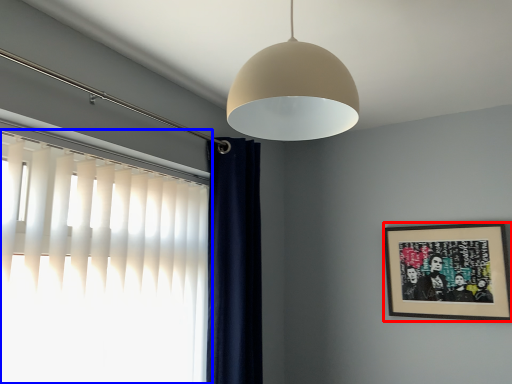
Question: Which of the following is the farthest to the observer, picture frame (highlighted by a red box) or window (highlighted by a blue box)?

Choices:
 (A) picture frame
 (B) window

Answer: (A)